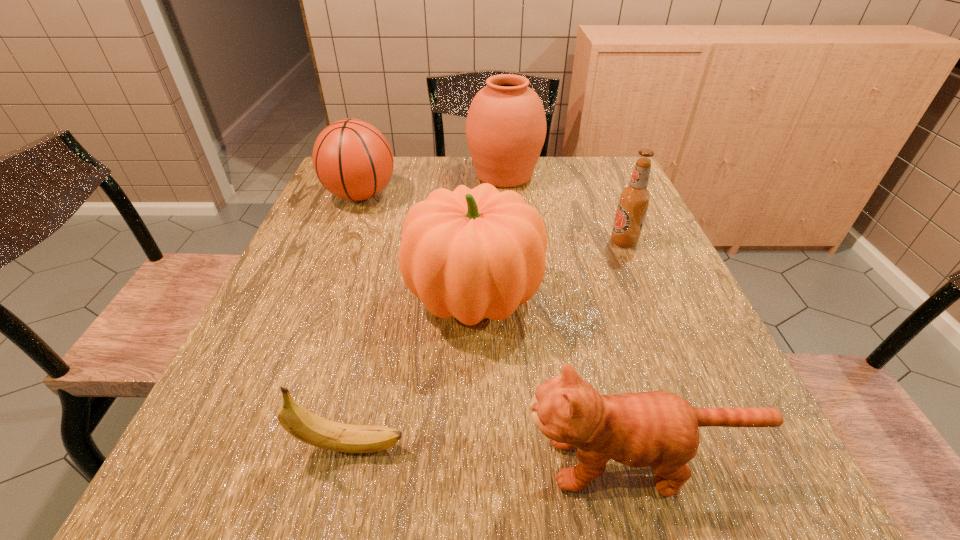
Locate an element on the screen. urn is located at coordinates (506, 126).

The height and width of the screenshot is (540, 960). Identify the location of pumpkin. (478, 253).

Locate an element on the screen. The width and height of the screenshot is (960, 540). beer bottle is located at coordinates (634, 199).

Locate an element on the screen. basketball is located at coordinates (352, 159).

What are the coordinates of `cat` in the screenshot? It's located at (659, 429).

Where is `banana`? The width and height of the screenshot is (960, 540). banana is located at coordinates (305, 426).

At what (x,y) coordinates should I click in order to perform the action: click on free space located on the front of the urn. Please return your answer as a coordinate pair (x, y). This screenshot has height=540, width=960. Looking at the image, I should click on (510, 242).

Find the location of a particular element. The width and height of the screenshot is (960, 540). vacant point located on the front of the fourth farthest object is located at coordinates (472, 476).

You are a GUI agent. You are given a task and a screenshot of the screen. Output one action in this format:
    pyautogui.click(x=<x>, y=<y>)
    Task: Click on the vacant point located on the front label of the beer bottle
    
    Given the screenshot: What is the action you would take?
    pyautogui.click(x=480, y=242)

Where is `free space located on the front label of the beer bottle`? This screenshot has height=540, width=960. free space located on the front label of the beer bottle is located at coordinates (572, 242).